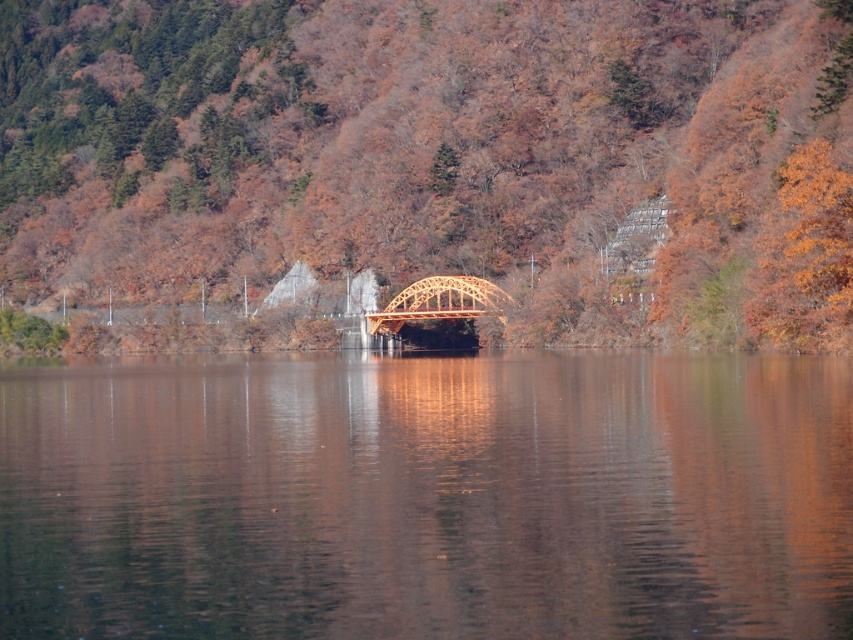
You are standing on the wooden bridge at center and looking towards the transparent water at center. Which object is lower in height?

The transparent water at center has a lesser height compared to the wooden bridge at center, so the transparent water at center is lower.

You are standing on the orange wood bridge at center and want to cross to the transparent water at center. Is the bridge positioned to your left or right side of the water?

The orange wood bridge at center is positioned on the left side of transparent water at center, so the bridge is to your left side of the water.